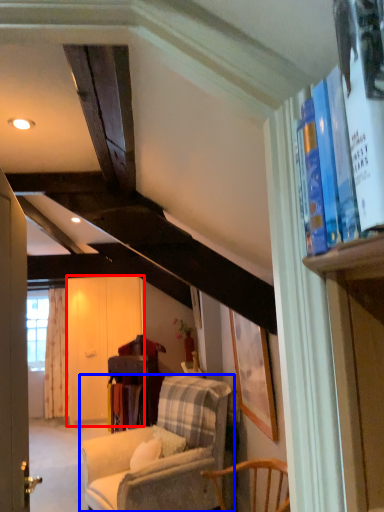
Question: Which object is further to the camera taking this photo, screen door (highlighted by a red box) or chair (highlighted by a blue box)?

Choices:
 (A) screen door
 (B) chair

Answer: (A)